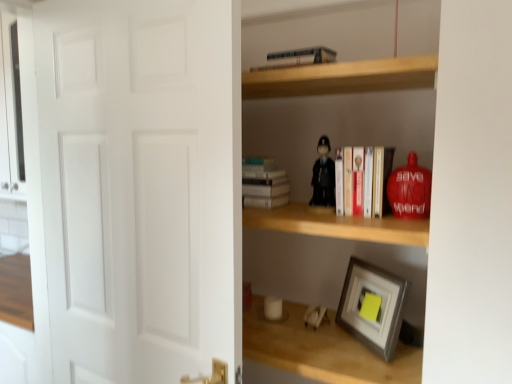
Question: Can you confirm if wooden shelf at center, the second shelf when ordered from bottom to top, is taller than white plastic toy at lower center, acting as the third toy starting from the front?

Choices:
 (A) yes
 (B) no

Answer: (A)

Question: Is wooden shelf at center, the first shelf when ordered from top to bottom, at the left side of white plastic toy at lower center, the 1th toy positioned from the left?

Choices:
 (A) yes
 (B) no

Answer: (A)

Question: From a real-world perspective, is wooden shelf at center, the first shelf when ordered from top to bottom, physically above white plastic toy at lower center, the first toy when ordered from back to front?

Choices:
 (A) no
 (B) yes

Answer: (B)

Question: Does wooden shelf at center, the second shelf when ordered from bottom to top, turn towards white plastic toy at lower center, arranged as the 3th toy when viewed from the top?

Choices:
 (A) no
 (B) yes

Answer: (A)

Question: From the image's perspective, is wooden shelf at center, the first shelf when ordered from top to bottom, under white plastic toy at lower center, the 1th toy positioned from the left?

Choices:
 (A) no
 (B) yes

Answer: (A)

Question: Can you confirm if wooden shelf at center, the second shelf when ordered from bottom to top, is positioned to the right of white plastic toy at lower center, acting as the third toy starting from the front?

Choices:
 (A) no
 (B) yes

Answer: (A)

Question: Is white matte door at left looking in the opposite direction of wooden shelf at center, the second shelf when ordered from bottom to top?

Choices:
 (A) yes
 (B) no

Answer: (A)

Question: Is the depth of white matte door at left greater than that of wooden shelf at center, the first shelf when ordered from top to bottom?

Choices:
 (A) no
 (B) yes

Answer: (A)

Question: Is white matte door at left wider than wooden shelf at center, the first shelf when ordered from top to bottom?

Choices:
 (A) no
 (B) yes

Answer: (A)

Question: From a real-world perspective, is white matte door at left located higher than wooden shelf at center, the first shelf when ordered from top to bottom?

Choices:
 (A) yes
 (B) no

Answer: (B)

Question: Can you confirm if white matte door at left is smaller than wooden shelf at center, the second shelf when ordered from bottom to top?

Choices:
 (A) yes
 (B) no

Answer: (A)

Question: Can you confirm if white matte door at left is positioned to the left of wooden shelf at center, the second shelf when ordered from bottom to top?

Choices:
 (A) no
 (B) yes

Answer: (B)

Question: Would you say wooden shelf at lower right, positioned as the 1th shelf in bottom-to-top order, contains hardcover books at center, arranged as the first book when ordered from the bottom?

Choices:
 (A) no
 (B) yes

Answer: (A)